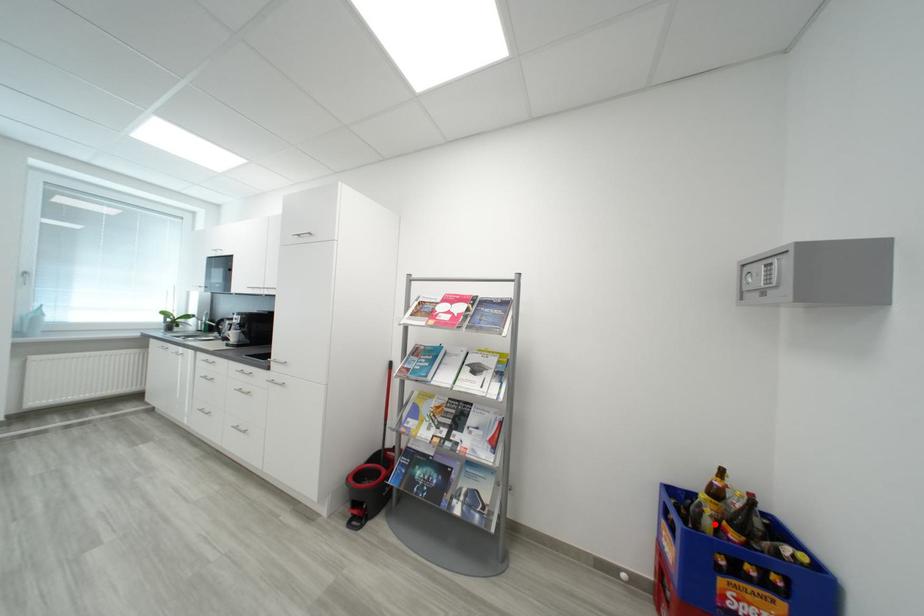
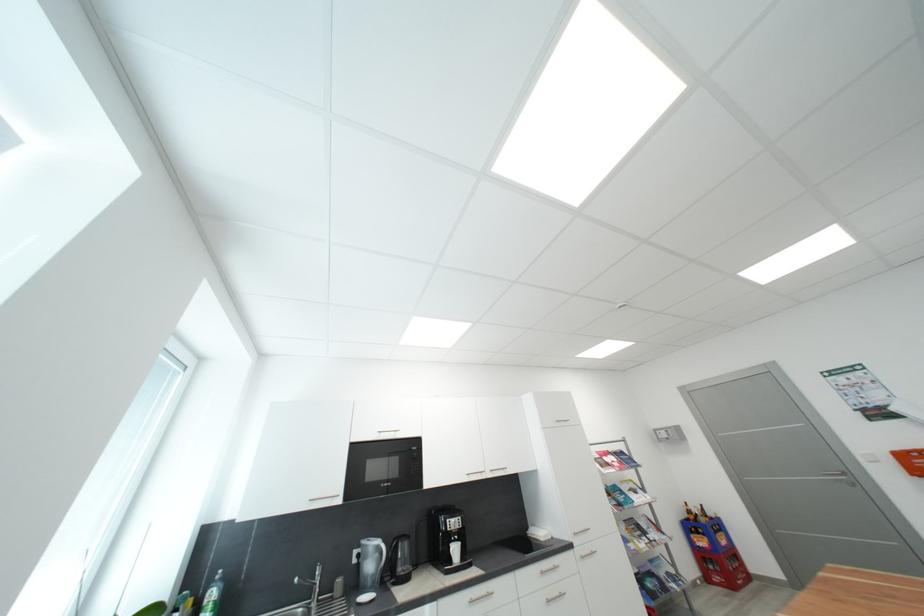
The point at the highlighted location is marked in the first image. Where is the corresponding point in the second image?

(710, 522)